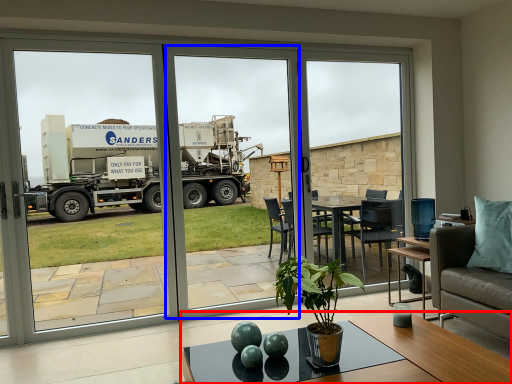
Question: Among these objects, which one is farthest to the camera, coffee table (highlighted by a red box) or screen door (highlighted by a blue box)?

Choices:
 (A) coffee table
 (B) screen door

Answer: (B)